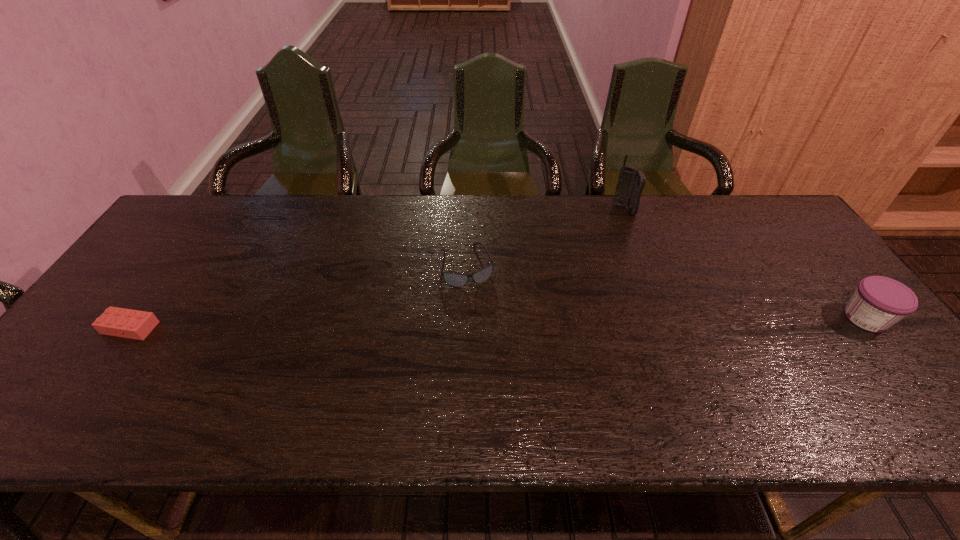
Identify the location of vacant space at the left edge of the desktop. The image size is (960, 540). (202, 252).

I want to click on vacant position at the right edge of the desktop, so click(803, 279).

In the image, there is a desktop. Where is `free space at the far right corner`? The width and height of the screenshot is (960, 540). free space at the far right corner is located at coordinates (784, 225).

The image size is (960, 540). I want to click on free spot between the sunglasses and the second tallest object, so click(666, 292).

What are the coordinates of `free space between the second farthest object and the jam` in the screenshot? It's located at (666, 292).

The image size is (960, 540). Find the location of `empty location between the third object from right to left and the cellular telephone`. empty location between the third object from right to left and the cellular telephone is located at coordinates (545, 238).

You are a GUI agent. You are given a task and a screenshot of the screen. Output one action in this format:
    pyautogui.click(x=<x>, y=<y>)
    Task: Click on the free point between the leftmost object and the third tallest object
    This screenshot has width=960, height=540.
    Given the screenshot: What is the action you would take?
    pyautogui.click(x=299, y=297)

Where is `free spot between the third shortest object and the Lego`? This screenshot has width=960, height=540. free spot between the third shortest object and the Lego is located at coordinates (498, 323).

Locate an element on the screen. free space between the jam and the cellular telephone is located at coordinates (745, 264).

Find the location of `free point between the third tallest object and the tallest object`. free point between the third tallest object and the tallest object is located at coordinates (545, 238).